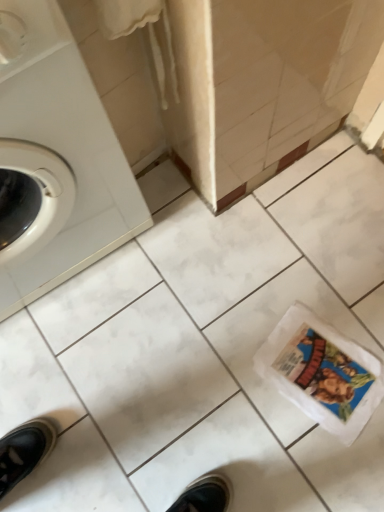
Find the location of a particular element. The height and width of the screenshot is (512, 384). white glossy washing machine at left is located at coordinates (64, 156).

Describe the element at coordinates (64, 156) in the screenshot. This screenshot has width=384, height=512. I see `white glossy washing machine at left` at that location.

Find the location of a particular element. This screenshot has width=384, height=512. white glossy washing machine at left is located at coordinates (64, 156).